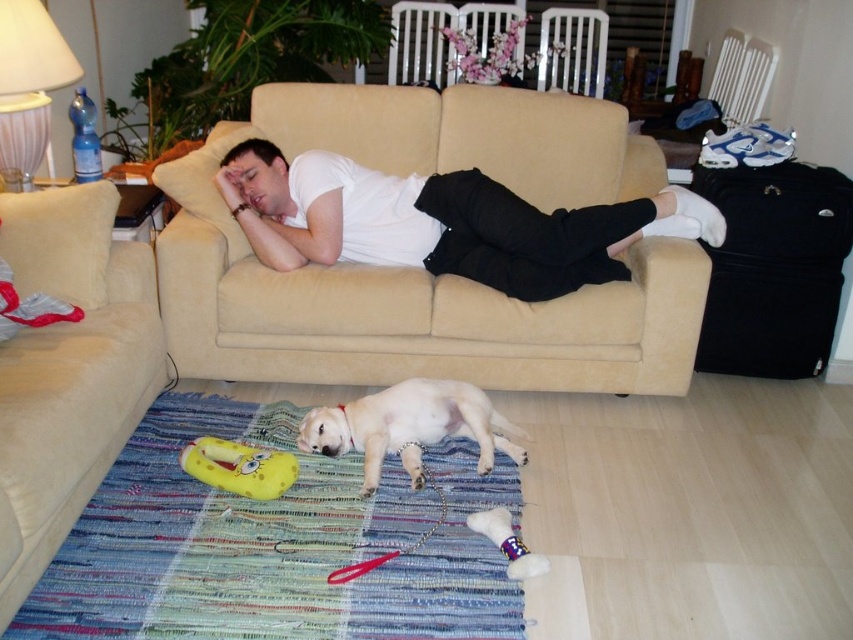
You are a delivery person standing in front of the beige fabric couch at lower left. You need to place a package that is 1.5 meters long on the couch. Can you fit the package on the couch?

The beige fabric couch at lower left is 1.54 meters from camera, so the package is slightly shorter than the couch length. It should fit with about 4 centimeters of space remaining.

You are a guest entering the living room and want to sit down. The beige fabric couch at lower left and the white fur dog at lower center are both in your path. Which object is larger in size?

The beige fabric couch at lower left is bigger than the white fur dog at lower center, so the couch is larger in size.